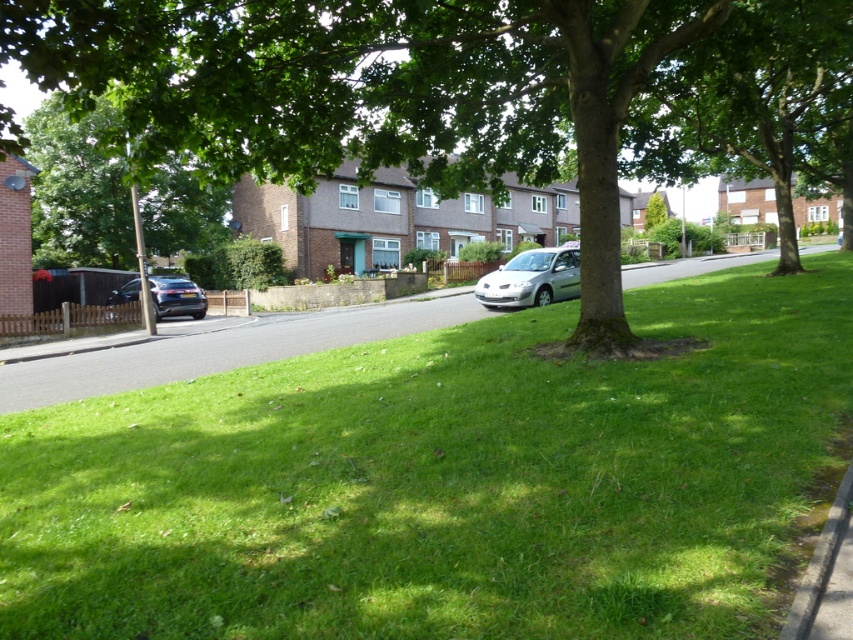
Does green grassy at center appear under satin black car at left?

Yes, green grassy at center is below satin black car at left.

How distant is green grassy at center from satin black car at left?

A distance of 68.09 feet exists between green grassy at center and satin black car at left.

Is point (492, 524) closer to viewer compared to point (122, 291)?

Yes.

Locate an element on the screen. green grassy at center is located at coordinates (450, 481).

Is green grass at lower center bigger than green leafy tree at upper left?

Yes.

Which of these two, green grass at lower center or green leafy tree at upper left, stands shorter?

green grass at lower center is shorter.

Who is more forward, (288,324) or (126,227)?

Positioned in front is point (288,324).

The height and width of the screenshot is (640, 853). Identify the location of green grass at lower center. [222, 348].

Between green grassy at center and gray concrete curb at lower right, which one appears on the left side from the viewer's perspective?

green grassy at center is more to the left.

Based on the photo, does green grassy at center have a lesser width compared to gray concrete curb at lower right?

In fact, green grassy at center might be wider than gray concrete curb at lower right.

Measure the distance between green grassy at center and camera.

green grassy at center is 3.36 meters away from camera.

Where is `green grassy at center`? green grassy at center is located at coordinates (450, 481).